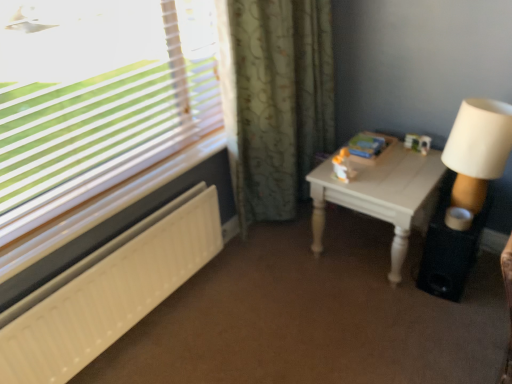
The height and width of the screenshot is (384, 512). Identify the location of free space to the left of white wood table at right. (287, 275).